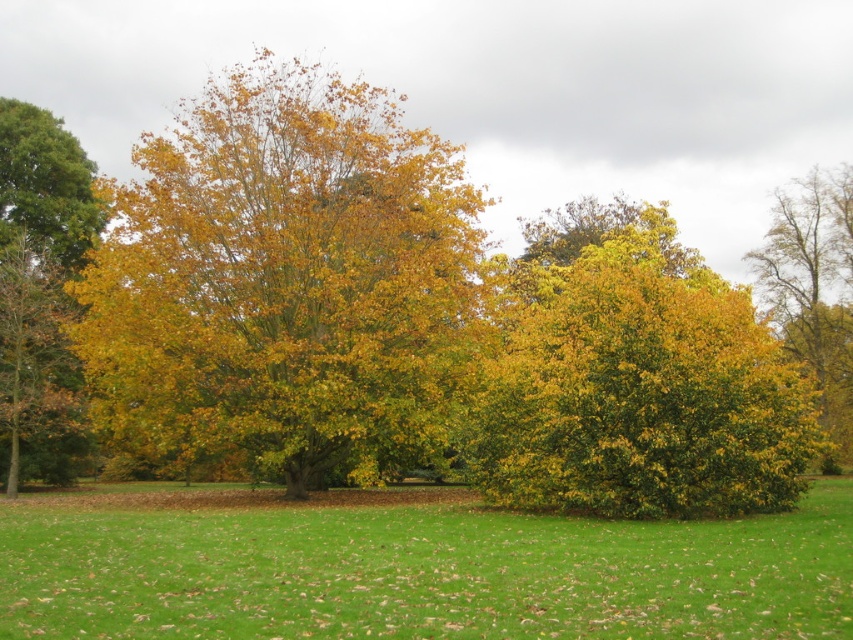
Question: Among these objects, which one is nearest to the camera?

Choices:
 (A) green grass at center
 (B) smooth brown tree trunk at right
 (C) yellow-green foliage at center

Answer: (A)

Question: Which point appears farthest from the camera in this image?

Choices:
 (A) (550, 564)
 (B) (790, 269)
 (C) (213, 193)

Answer: (B)

Question: Which is nearer to the green grass at center?

Choices:
 (A) smooth brown tree trunk at right
 (B) yellow-green foliage at center

Answer: (B)

Question: Considering the relative positions of yellow-green foliage at center and smooth brown tree trunk at right in the image provided, where is yellow-green foliage at center located with respect to smooth brown tree trunk at right?

Choices:
 (A) right
 (B) left

Answer: (B)

Question: Can you confirm if yellow-green foliage at center is wider than green grass at center?

Choices:
 (A) yes
 (B) no

Answer: (A)

Question: Does yellow-green foliage at center have a greater width compared to smooth brown tree trunk at right?

Choices:
 (A) yes
 (B) no

Answer: (A)